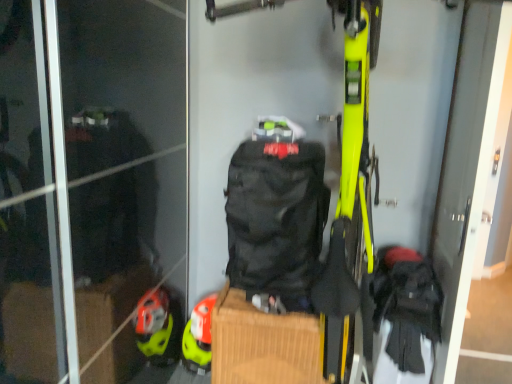
Question: Is the position of black fabric screen door at right more distant than that of black fabric backpack at center?

Choices:
 (A) yes
 (B) no

Answer: (B)

Question: Is black fabric screen door at right not close to black fabric backpack at center?

Choices:
 (A) no
 (B) yes

Answer: (A)

Question: Does black fabric screen door at right have a greater height compared to black fabric backpack at center?

Choices:
 (A) yes
 (B) no

Answer: (A)

Question: Considering the relative sizes of black fabric screen door at right and black fabric backpack at center in the image provided, is black fabric screen door at right bigger than black fabric backpack at center?

Choices:
 (A) yes
 (B) no

Answer: (A)

Question: Is black fabric screen door at right completely or partially outside of black fabric backpack at center?

Choices:
 (A) no
 (B) yes

Answer: (B)

Question: Considering the relative sizes of black fabric screen door at right and black fabric backpack at center in the image provided, is black fabric screen door at right shorter than black fabric backpack at center?

Choices:
 (A) yes
 (B) no

Answer: (B)

Question: Is black fabric backpack at center facing towards matte yellow helmet at lower left?

Choices:
 (A) no
 (B) yes

Answer: (A)

Question: Considering the relative sizes of black fabric backpack at center and matte yellow helmet at lower left in the image provided, is black fabric backpack at center smaller than matte yellow helmet at lower left?

Choices:
 (A) no
 (B) yes

Answer: (A)

Question: Is matte yellow helmet at lower left located within black fabric backpack at center?

Choices:
 (A) yes
 (B) no

Answer: (B)

Question: Does black fabric backpack at center have a lesser height compared to matte yellow helmet at lower left?

Choices:
 (A) no
 (B) yes

Answer: (A)

Question: Is black fabric backpack at center turned away from matte yellow helmet at lower left?

Choices:
 (A) yes
 (B) no

Answer: (B)

Question: Is black fabric backpack at center to the right of matte yellow helmet at lower left from the viewer's perspective?

Choices:
 (A) no
 (B) yes

Answer: (B)

Question: Considering the relative sizes of matte yellow helmet at lower left and black fabric screen door at right in the image provided, is matte yellow helmet at lower left bigger than black fabric screen door at right?

Choices:
 (A) no
 (B) yes

Answer: (A)